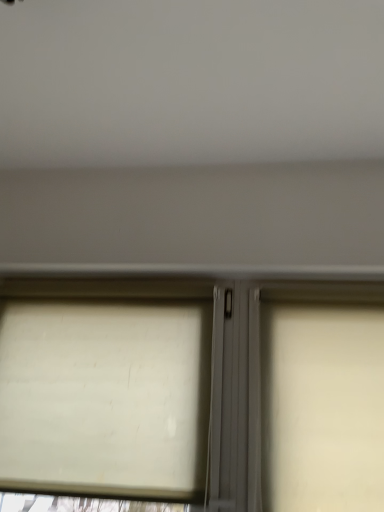
What is the approximate height of matte glass window at center?

It is 26.39 inches.

Identify the location of matte glass window at center. The image size is (384, 512). (139, 387).

What do you see at coordinates (139, 387) in the screenshot? I see `matte glass window at center` at bounding box center [139, 387].

You are a GUI agent. You are given a task and a screenshot of the screen. Output one action in this format:
    pyautogui.click(x=<x>, y=<y>)
    Task: Click on the matte glass window at center
    
    Given the screenshot: What is the action you would take?
    pyautogui.click(x=139, y=387)